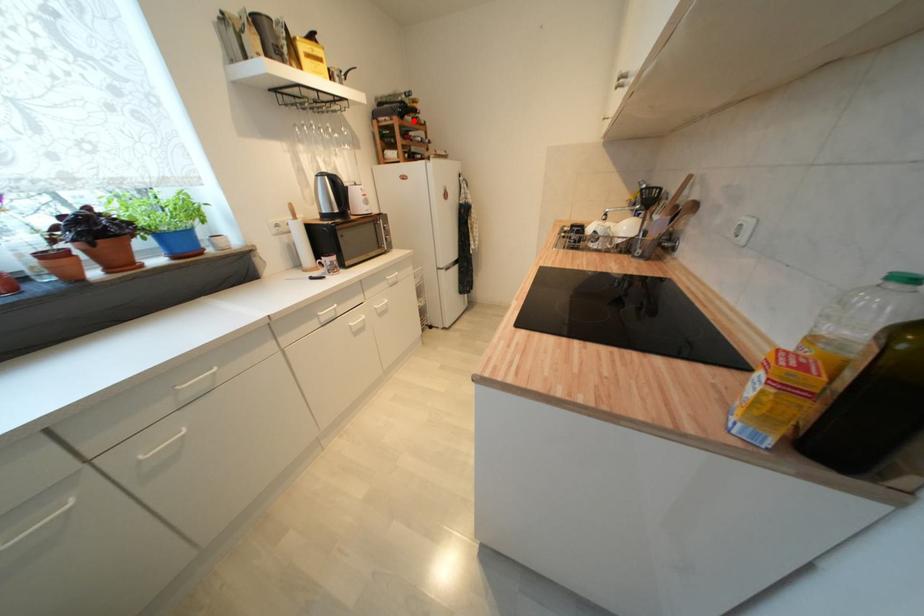
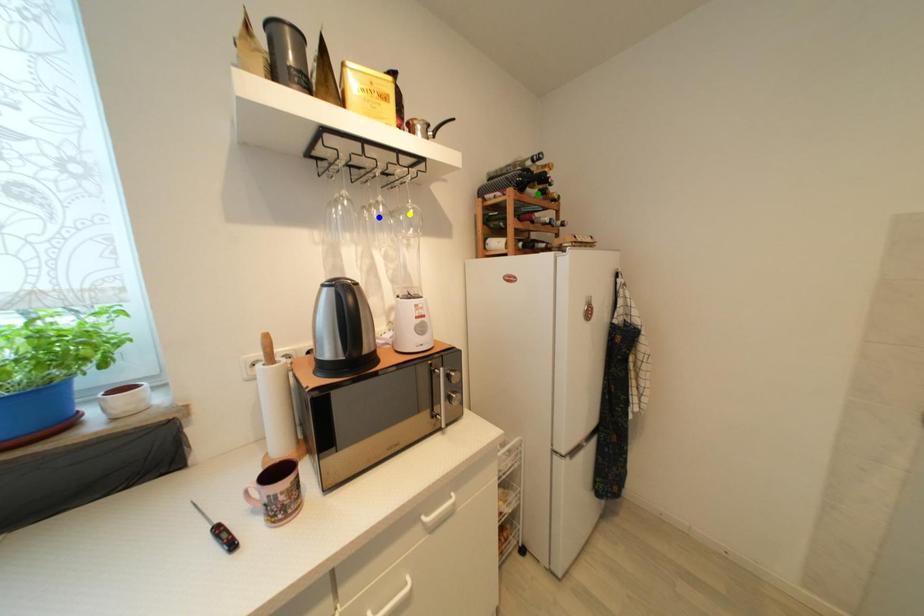
Question: I am providing you with two images of the same scene from different viewpoints. A red point is marked on the first image. You are given multiple points on the second image. Which point in image 2 represents the same 3d spot as the red point in image 1?

Choices:
 (A) blue point
 (B) yellow point
 (C) green point

Answer: (C)